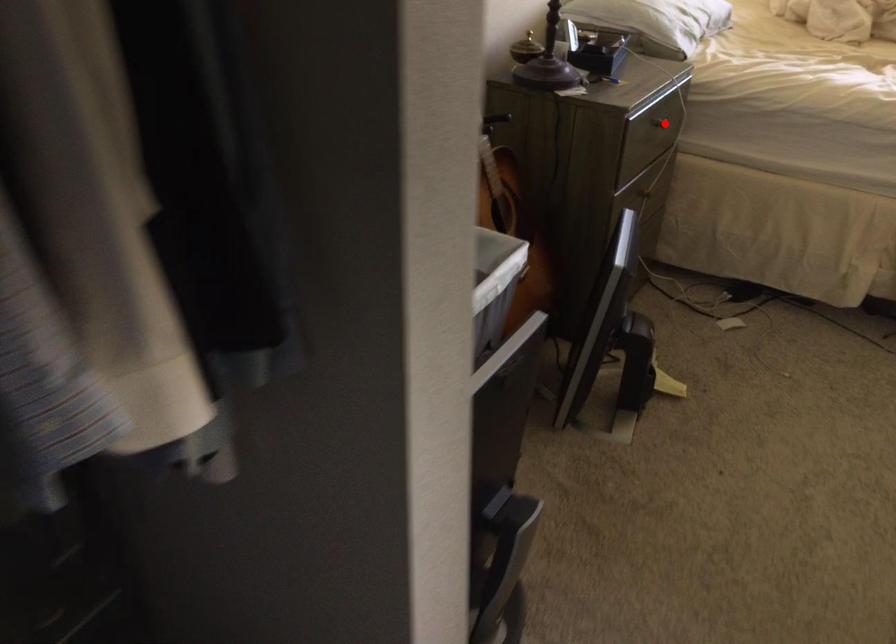
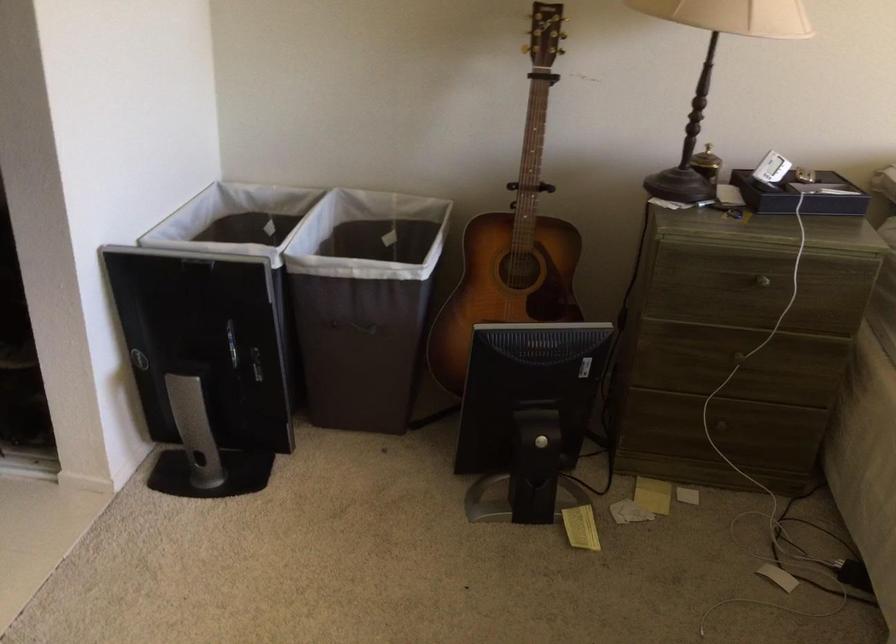
Question: I am providing you with two images of the same scene from different viewpoints. Given a red point in image1, look at the same physical point in image2. Is it:

Choices:
 (A) Closer to the viewpoint
 (B) Farther from the viewpoint

Answer: (A)